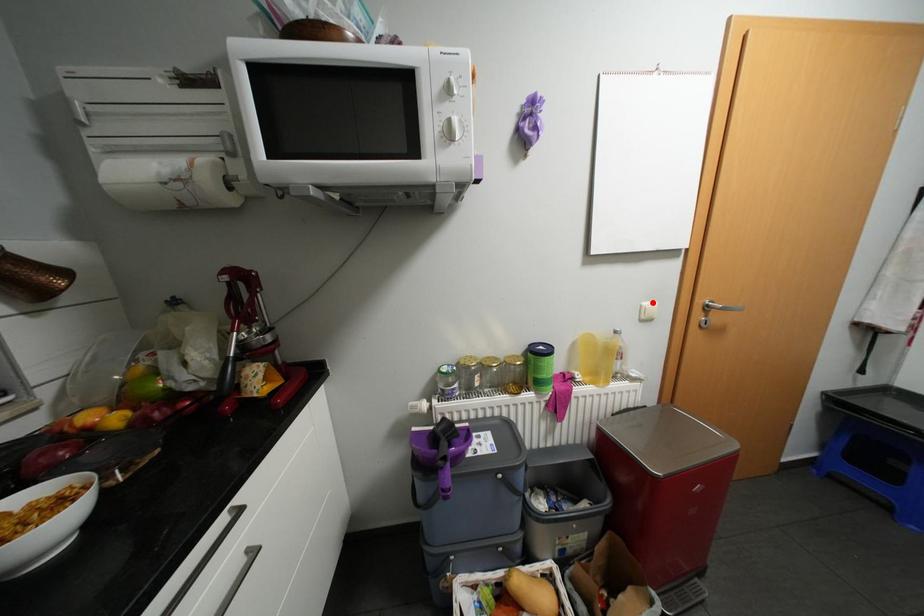
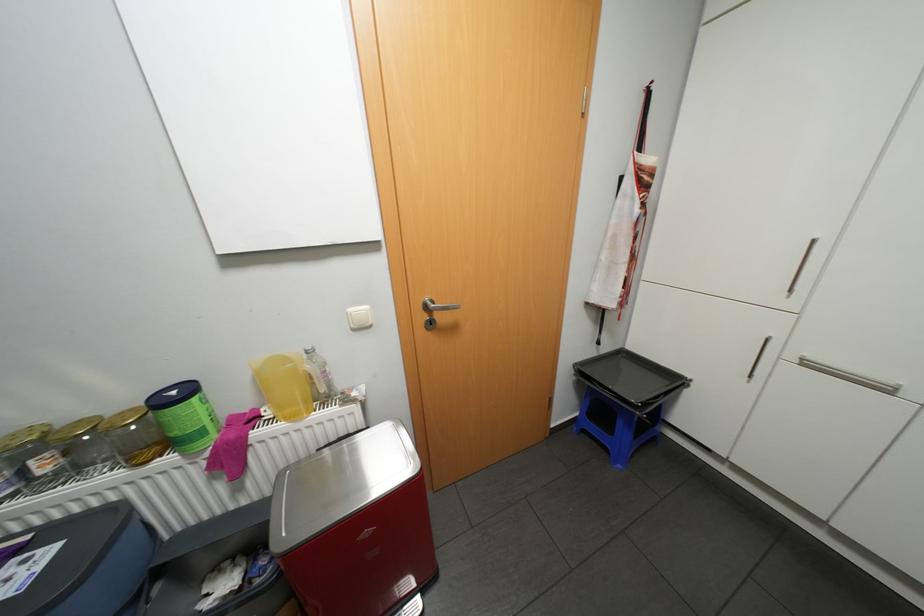
Find the pixel in the second image that matches the highlighted location in the first image.

(358, 309)